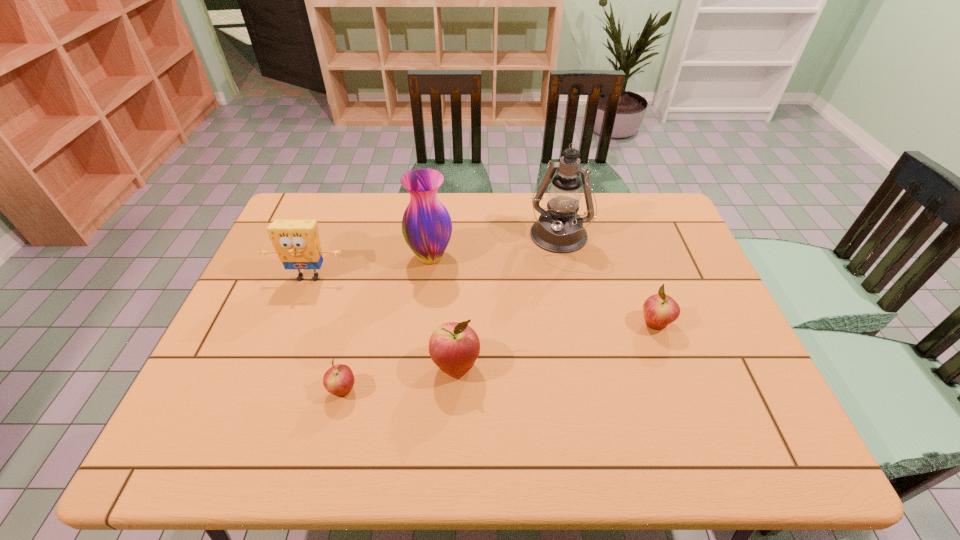
I want to click on free space located on the back of the farthest apple, so click(x=635, y=268).

Where is `free space located on the front of the second tallest object`? The width and height of the screenshot is (960, 540). free space located on the front of the second tallest object is located at coordinates (422, 327).

You are a GUI agent. You are given a task and a screenshot of the screen. Output one action in this format:
    pyautogui.click(x=<x>, y=<y>)
    Task: Click on the free spot located on the front of the second object from right to left
    The image size is (960, 540).
    Given the screenshot: What is the action you would take?
    pyautogui.click(x=580, y=351)

Where is `vacant point located 0.160m on the face of the leftmost object`? The image size is (960, 540). vacant point located 0.160m on the face of the leftmost object is located at coordinates (287, 334).

I want to click on object at the far edge, so click(x=559, y=229).

Identify the location of object that is positioned at the left edge. The width and height of the screenshot is (960, 540). [x=296, y=242].

I want to click on object at the right edge, so click(x=659, y=310).

I want to click on vacant space at the far edge of the desktop, so click(x=384, y=230).

The width and height of the screenshot is (960, 540). Identify the location of free space at the near edge of the desktop. (582, 400).

This screenshot has width=960, height=540. I want to click on vacant region at the far left corner of the desktop, so click(x=319, y=230).